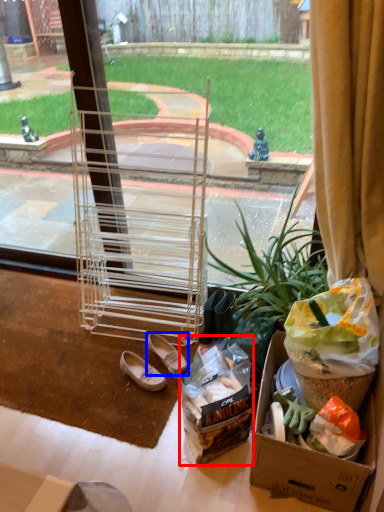
Question: Among these objects, which one is nearest to the camera, waste (highlighted by a red box) or footwear (highlighted by a blue box)?

Choices:
 (A) waste
 (B) footwear

Answer: (A)